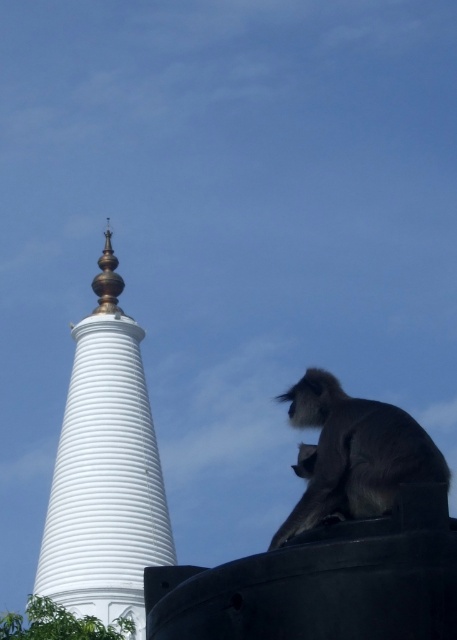
You are standing in front of the scene and want to take a photo that includes both the white smooth stupa at left and the gray furry monkey at lower right. Which object should you adjust your camera focus on first to ensure both are in focus?

You should focus on the white smooth stupa at left first because it is closer to you than the gray furry monkey at lower right, allowing both to be in focus when using depth of field properly.

You are a photographer standing in front of the white smooth stupa at left and the gray furry monkey at lower right. You want to take a photo that includes both objects in the frame. Based on their positions, which object should you focus on first to ensure both are in the frame?

The white smooth stupa at left is located below the gray furry monkey at lower right, so you should focus on the gray furry monkey at lower right first to ensure both are in the frame.